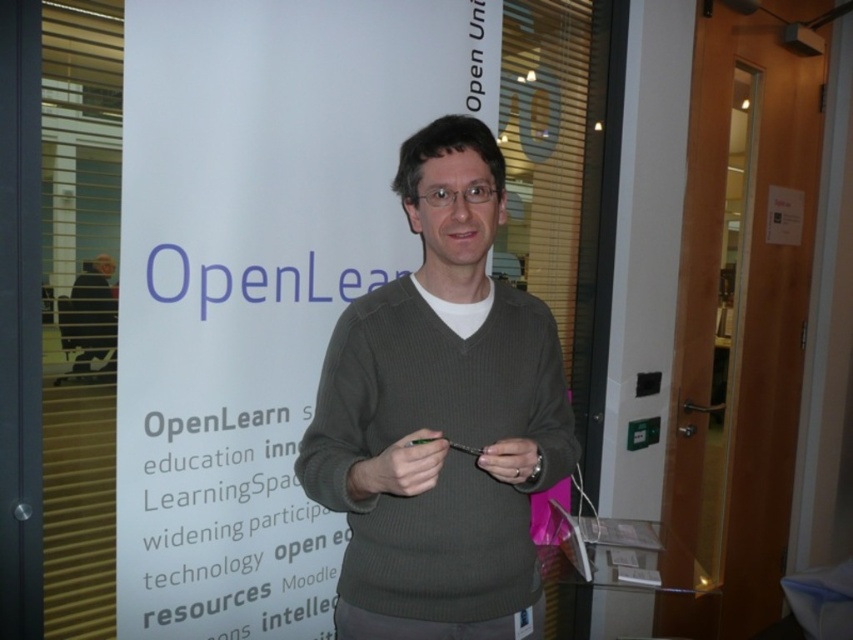
You are an observer looking at the image. There is a knitted sweater at center and a matte gray hand at center. Which object is positioned more to the left?

The knitted sweater at center is positioned to the left of the matte gray hand at center, so the knitted sweater at center is more to the left.

Looking at this image, you are attending an event at the OpenLearn banner and need to locate two points marked on the banner. The points are labeled as point 1 at coordinates point (428, 557) and point 2 at coordinates point (354, 480). Which point is closer to you, the viewer?

Point (428, 557) is further to the viewer than point (354, 480). Therefore, point (354, 480) is closer to you.